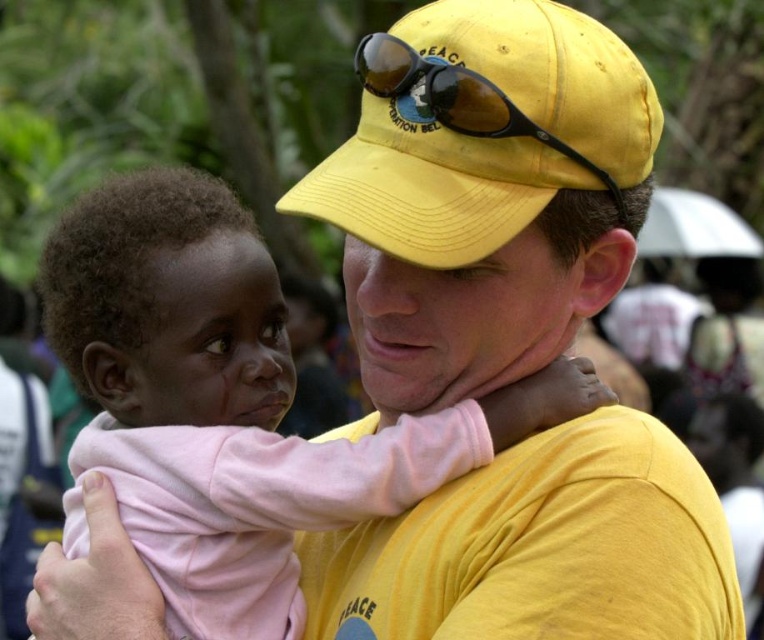
Who is lower down, pink fleece baby at center or yellow matte sunglasses at center?

Positioned lower is pink fleece baby at center.

Is pink fleece baby at center above yellow matte sunglasses at center?

Actually, pink fleece baby at center is below yellow matte sunglasses at center.

Where is `pink fleece baby at center`? pink fleece baby at center is located at coordinates click(x=167, y=305).